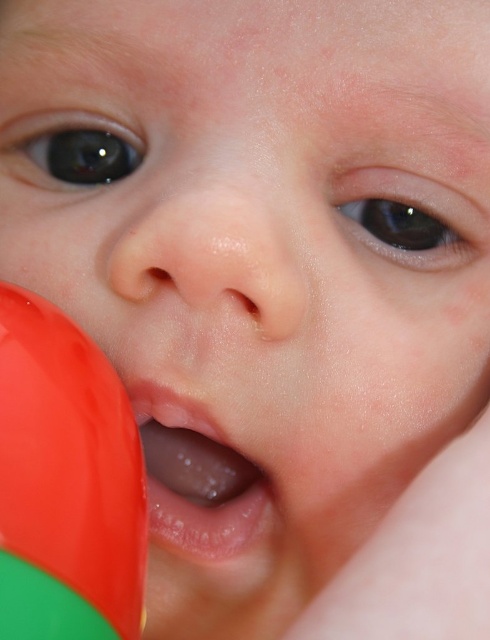
Does smooth skin nose at center lie behind transparent plastic mouth at center?

No, it is in front of transparent plastic mouth at center.

Where is `smooth skin nose at center`? smooth skin nose at center is located at coordinates (213, 259).

Which is behind, point (190, 282) or point (220, 474)?

The point (220, 474) is more distant.

This screenshot has width=490, height=640. What are the coordinates of `smooth skin nose at center` in the screenshot? It's located at (213, 259).

Does point (100, 493) lie in front of point (174, 493)?

Yes, point (100, 493) is in front of point (174, 493).

What do you see at coordinates (66, 483) in the screenshot? This screenshot has width=490, height=640. I see `rubberized red ball at lower left` at bounding box center [66, 483].

Does point (82, 579) lie behind point (163, 412)?

No, (82, 579) is closer to viewer.

I want to click on rubberized red ball at lower left, so click(x=66, y=483).

Consider the image. Is rubberized red ball at lower left positioned at the back of smooth skin nose at center?

That is False.

Is rubberized red ball at lower left positioned before smooth skin nose at center?

That is True.

Between point (45, 381) and point (175, 216), which one is positioned in front?

Positioned in front is point (45, 381).

Image resolution: width=490 pixels, height=640 pixels. Identify the location of rubberized red ball at lower left. (66, 483).